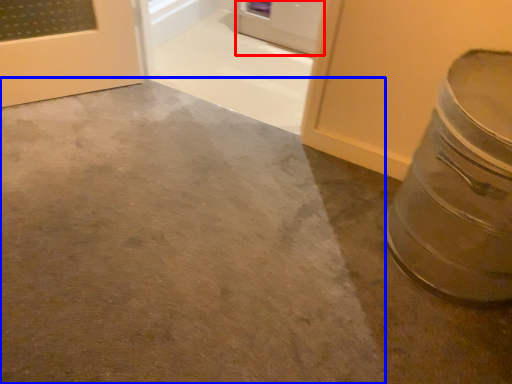
Question: Which object is closer to the camera taking this photo, door (highlighted by a red box) or concrete (highlighted by a blue box)?

Choices:
 (A) door
 (B) concrete

Answer: (B)